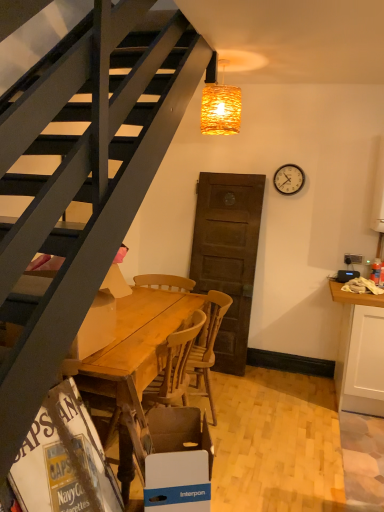
Question: From a real-world perspective, relative to blue cardboard box at lower center, the 1th box from the bottom, is wooden table at lower left, marked as the first box in a left-to-right arrangement, vertically above or below?

Choices:
 (A) below
 (B) above

Answer: (B)

Question: From the image's perspective, is wooden table at lower left, the first box in the top-to-bottom sequence, above or below blue cardboard box at lower center, positioned as the second box in left-to-right order?

Choices:
 (A) below
 (B) above

Answer: (B)

Question: Estimate the real-world distances between objects in this image. Which object is farther from the wooden table at lower left, marked as the second box in a bottom-to-top arrangement?

Choices:
 (A) wooden table at center
 (B) wooden at center
 (C) woven wicker lampshade at upper center
 (D) translucent plastic bottle at right
 (E) blue cardboard box at lower center, the 2th box in the top-to-bottom sequence

Answer: (D)

Question: Which object is positioned farthest from the translucent plastic bottle at right?

Choices:
 (A) wooden table at center
 (B) wooden table at lower left, the first box in the top-to-bottom sequence
 (C) wooden at center
 (D) white cardboard magazine at lower left
 (E) blue cardboard box at lower center, positioned as the second box in left-to-right order

Answer: (D)